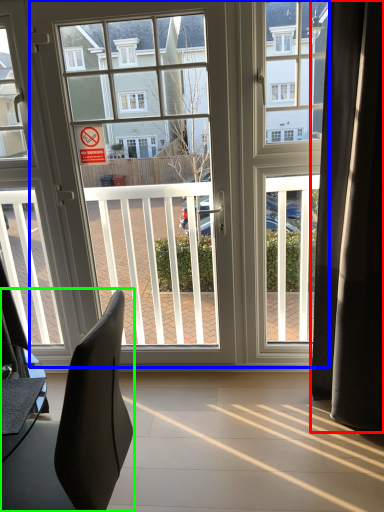
Question: Which object is the farthest from curtain (highlighted by a red box)? Choose among these: door (highlighted by a blue box) or chair (highlighted by a green box).

Choices:
 (A) door
 (B) chair

Answer: (B)